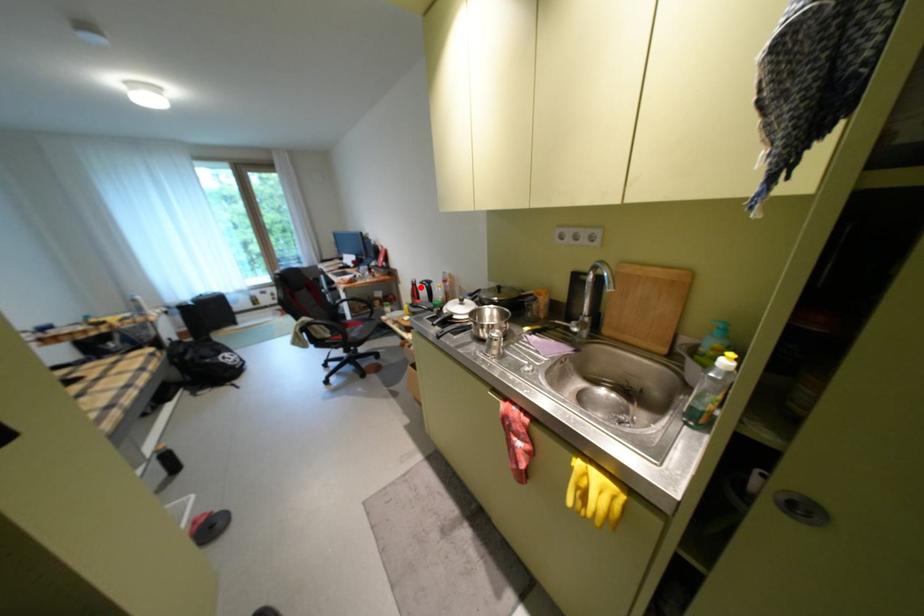
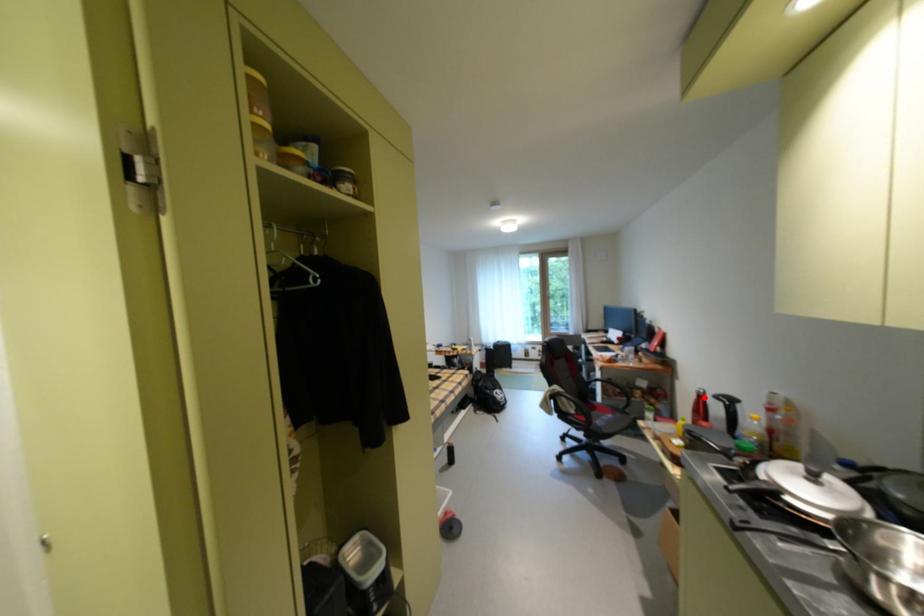
I am providing you with two images of the same scene from different viewpoints. A red point is marked on the first image and another point is marked on the second image. Is the marked point in image1 the same physical position as the marked point in image2?

Yes